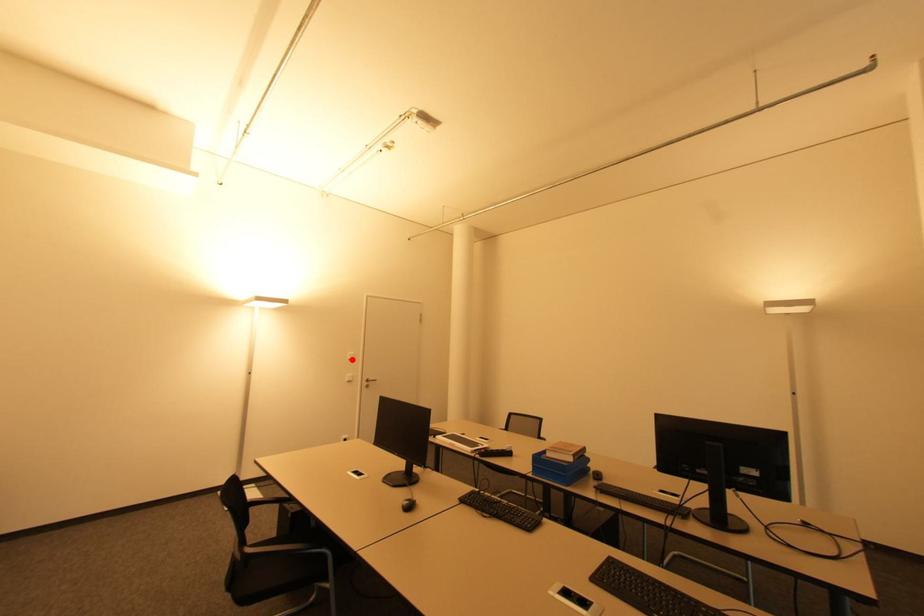
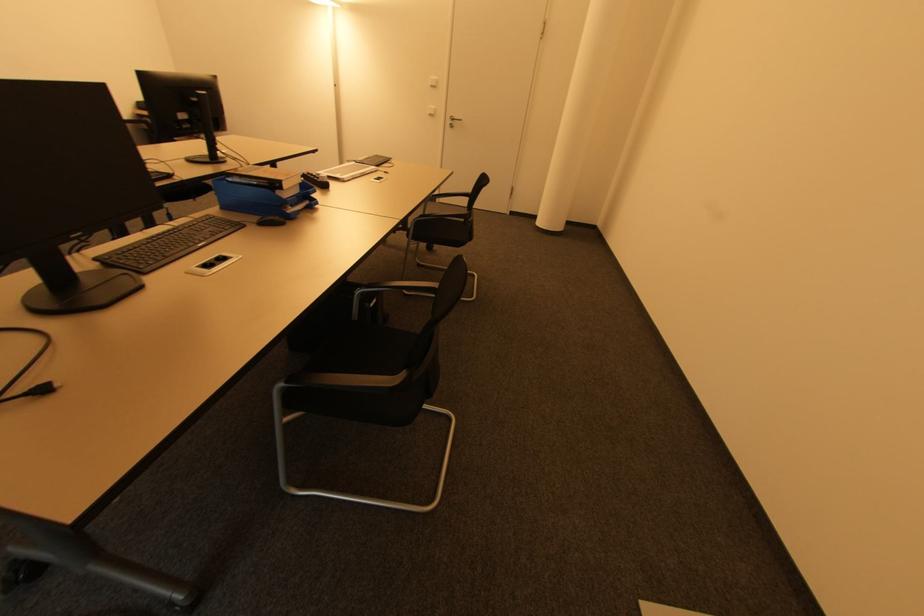
Find the pixel in the second image that matches the highlighted location in the first image.

(434, 87)